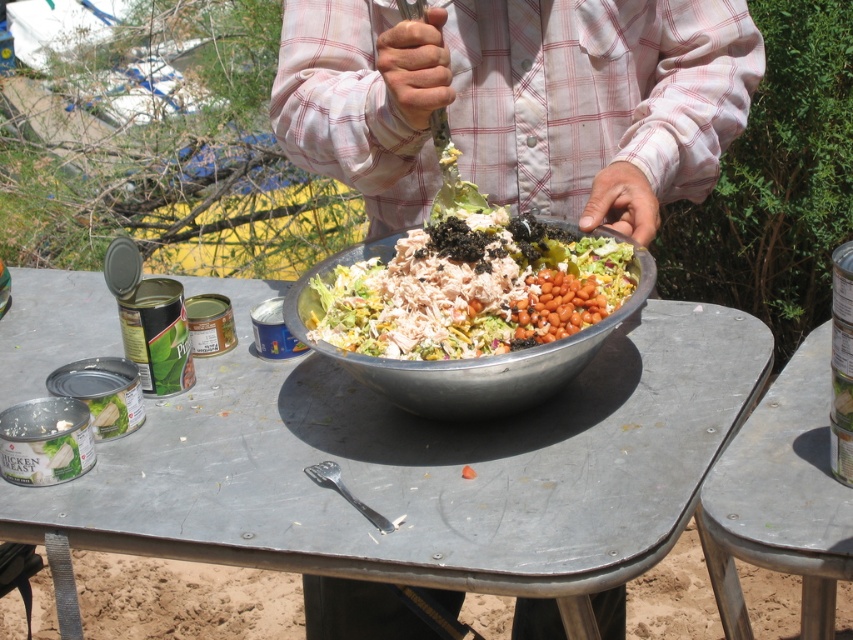
Question: Estimate the real-world distances between objects in this image. Which object is farther from the metallic gray picnic table at lower right?

Choices:
 (A) plaid shirt at center
 (B) shiny metallic bowl at center
 (C) metallic gray table at center

Answer: (A)

Question: Which of the following is the closest to the observer?

Choices:
 (A) (785, 371)
 (B) (538, 388)

Answer: (B)

Question: Is shiny metallic bowl at center positioned behind metallic gray picnic table at lower right?

Choices:
 (A) no
 (B) yes

Answer: (B)

Question: Among these objects, which one is nearest to the camera?

Choices:
 (A) metallic gray picnic table at lower right
 (B) plaid shirt at center
 (C) shiny metallic bowl at center

Answer: (A)

Question: Does plaid shirt at center appear over metallic silver bowl at center?

Choices:
 (A) yes
 (B) no

Answer: (A)

Question: Is shiny metallic bowl at center further to the viewer compared to metallic gray picnic table at lower right?

Choices:
 (A) no
 (B) yes

Answer: (B)